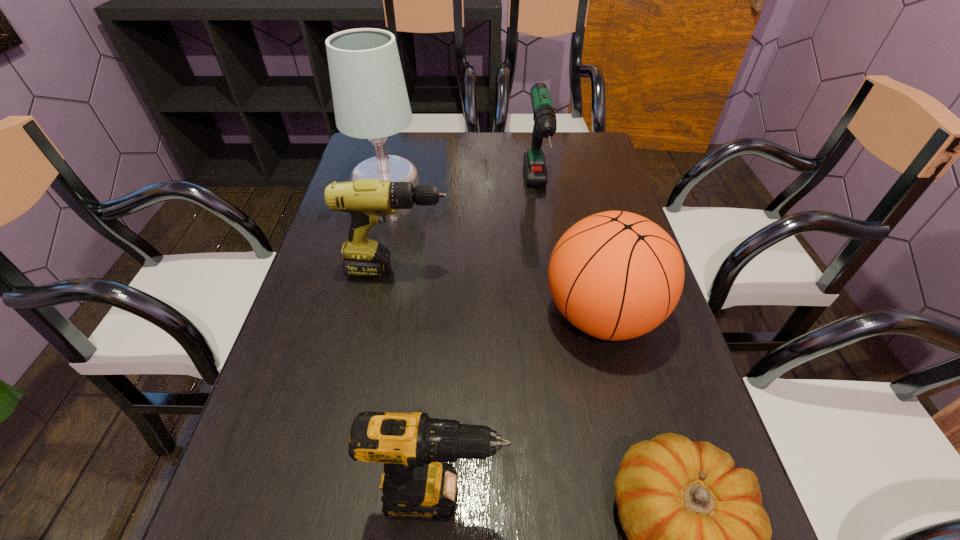
The image size is (960, 540). Find the location of `vacant space that satisfies the following two spatial constraints: 1. on the base of the tallest object; 2. on the left side of the basketball`. vacant space that satisfies the following two spatial constraints: 1. on the base of the tallest object; 2. on the left side of the basketball is located at coordinates pos(354,315).

I want to click on free space that satisfies the following two spatial constraints: 1. on the handle side of the farthest drill; 2. on the left side of the basketball, so coord(556,315).

Find the location of a particular element. Image resolution: width=960 pixels, height=540 pixels. free location that satisfies the following two spatial constraints: 1. on the handle side of the rightmost drill; 2. on the right side of the basketball is located at coordinates (556, 315).